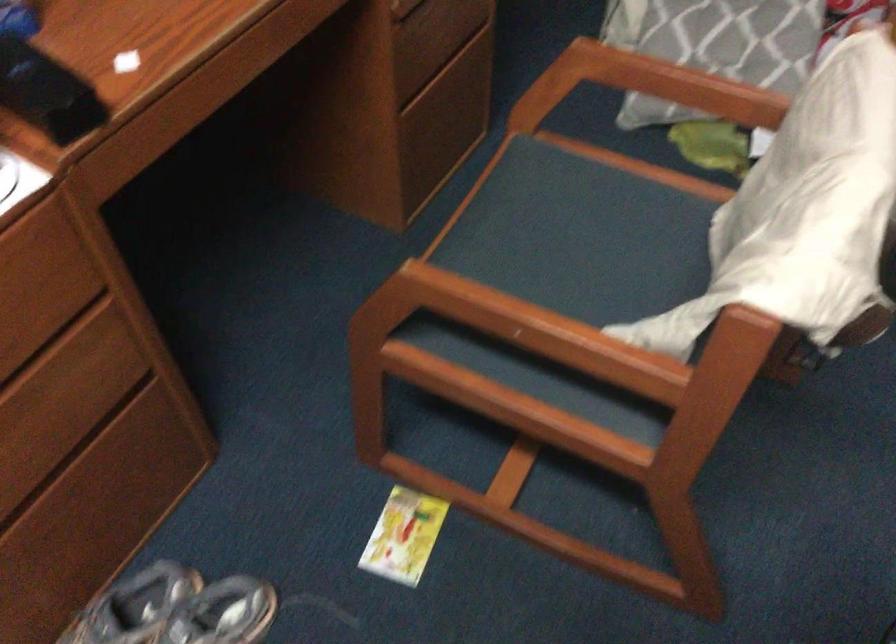
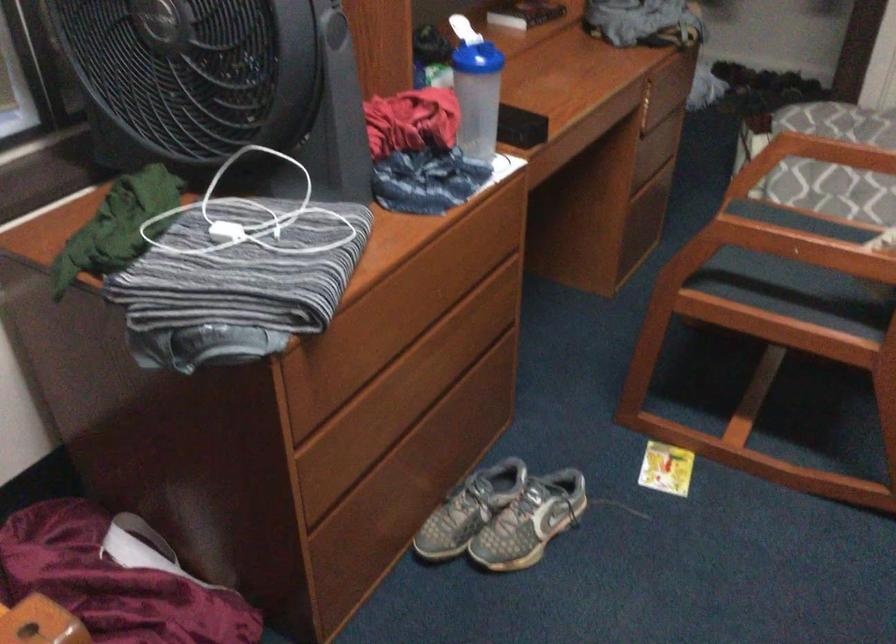
Where in the second image is the point corresponding to the point at 497,326 from the first image?

(790, 245)